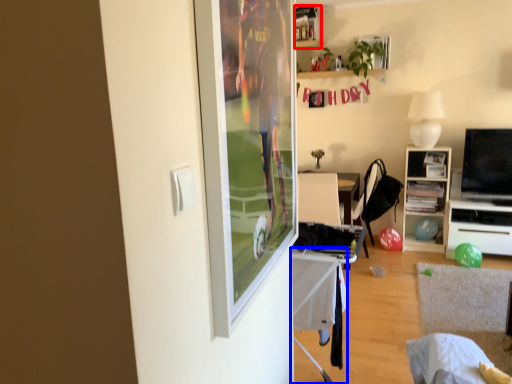
Question: Which object is closer to the camera taking this photo, shelf (highlighted by a red box) or table (highlighted by a blue box)?

Choices:
 (A) shelf
 (B) table

Answer: (B)